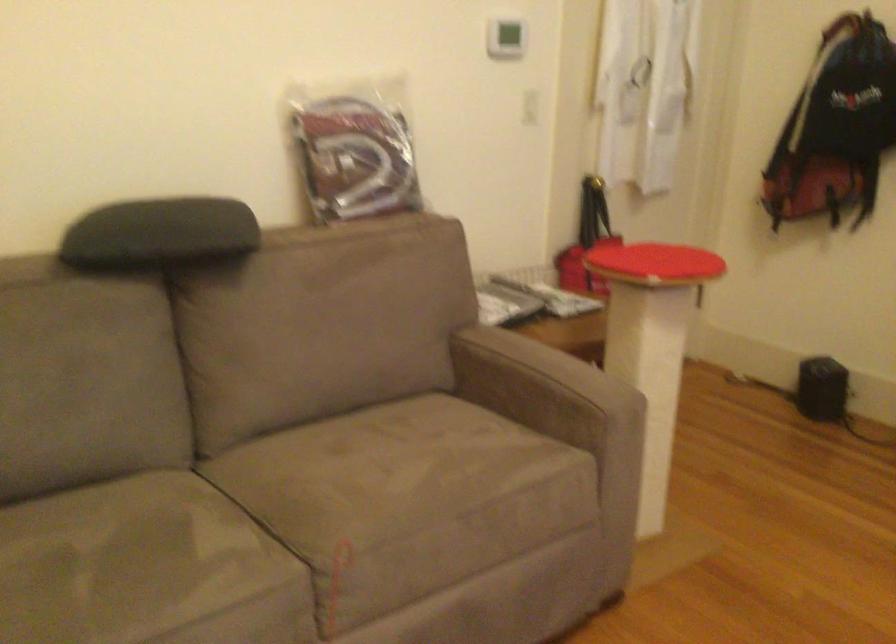
Find where to sit the sofa sitting surface. Please return your answer as a coordinate pair (x, y).

(319, 540)